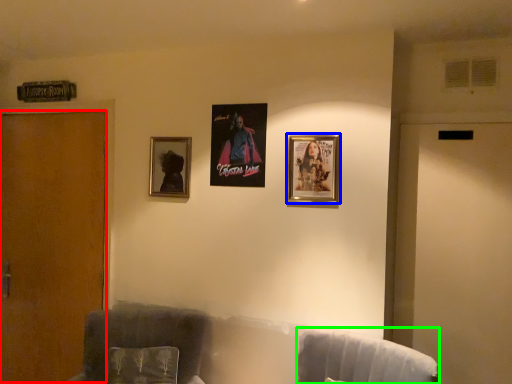
Question: Considering the real-world distances, which object is closest to door (highlighted by a red box)? picture frame (highlighted by a blue box) or swivel chair (highlighted by a green box).

Choices:
 (A) picture frame
 (B) swivel chair

Answer: (A)